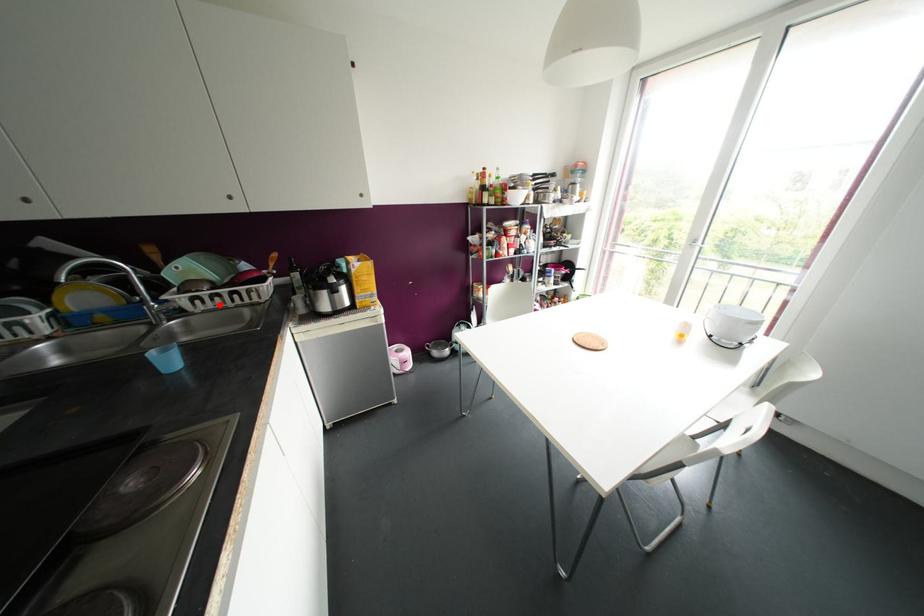
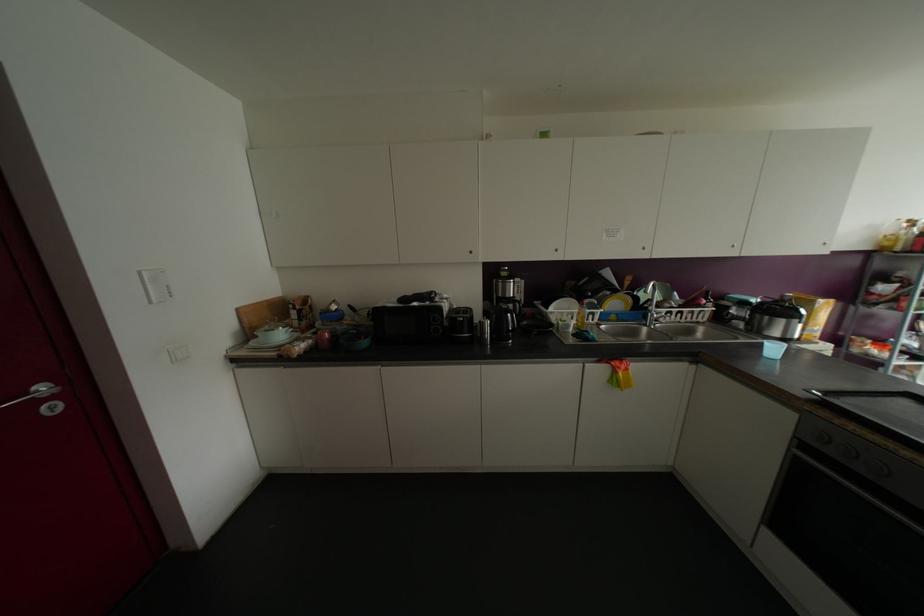
In the second image, find the point that corresponds to the highlighted location in the first image.

(677, 318)